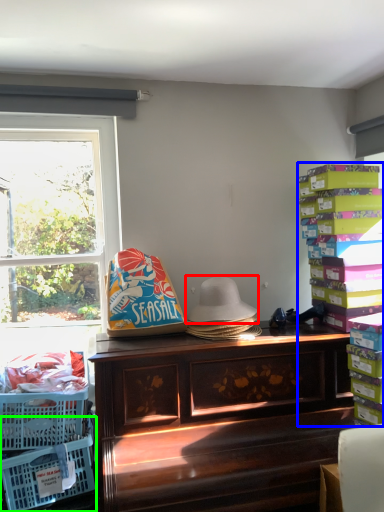
Question: Which is farther away from hat (highlighted by a red box)? book (highlighted by a blue box) or basket (highlighted by a green box)?

Choices:
 (A) book
 (B) basket

Answer: (B)